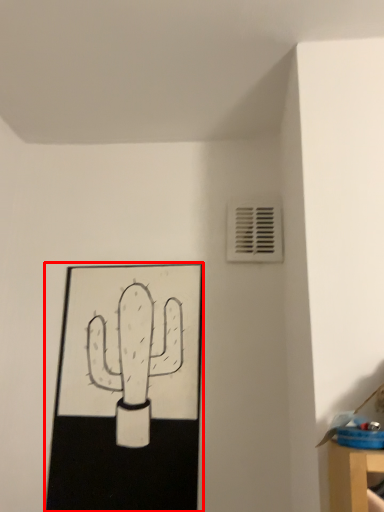
Question: From the image, what is the correct spatial relationship of picture frame (annotated by the red box) in relation to air conditioning?

Choices:
 (A) left
 (B) right

Answer: (A)